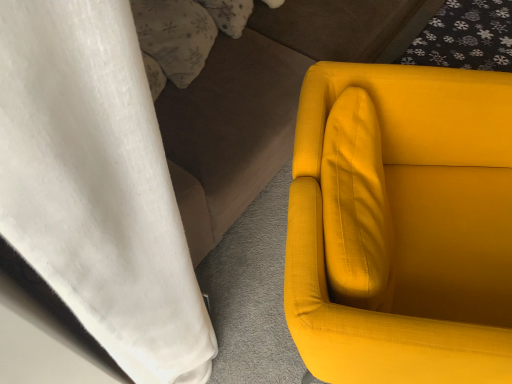
Question: Is fluffy white pillow at upper left looking in the opposite direction of matte yellow fabric chair at right?

Choices:
 (A) yes
 (B) no

Answer: (B)

Question: From a real-world perspective, is fluffy white pillow at upper left located higher than matte yellow fabric chair at right?

Choices:
 (A) yes
 (B) no

Answer: (A)

Question: Is fluffy white pillow at upper left positioned behind matte yellow fabric chair at right?

Choices:
 (A) yes
 (B) no

Answer: (A)

Question: Is matte yellow fabric chair at right surrounded by fluffy white pillow at upper left?

Choices:
 (A) yes
 (B) no

Answer: (B)

Question: Does fluffy white pillow at upper left have a greater height compared to matte yellow fabric chair at right?

Choices:
 (A) no
 (B) yes

Answer: (A)

Question: From the image's perspective, is fluffy white pillow at upper left positioned above or below matte yellow fabric couch at right?

Choices:
 (A) below
 (B) above

Answer: (A)

Question: Considering their positions, is fluffy white pillow at upper left located in front of or behind matte yellow fabric couch at right?

Choices:
 (A) behind
 (B) front

Answer: (A)

Question: Looking at the image, does fluffy white pillow at upper left seem bigger or smaller compared to matte yellow fabric couch at right?

Choices:
 (A) small
 (B) big

Answer: (A)

Question: Is fluffy white pillow at upper left situated inside matte yellow fabric couch at right or outside?

Choices:
 (A) outside
 (B) inside

Answer: (B)

Question: Looking at their shapes, would you say matte yellow fabric chair at right is wider or thinner than matte yellow fabric couch at right?

Choices:
 (A) thin
 (B) wide

Answer: (A)

Question: From their relative heights in the image, would you say matte yellow fabric chair at right is taller or shorter than matte yellow fabric couch at right?

Choices:
 (A) tall
 (B) short

Answer: (B)

Question: Is matte yellow fabric chair at right situated inside matte yellow fabric couch at right or outside?

Choices:
 (A) inside
 (B) outside

Answer: (B)

Question: Considering their positions, is matte yellow fabric chair at right located in front of or behind matte yellow fabric couch at right?

Choices:
 (A) behind
 (B) front

Answer: (B)

Question: Visually, is fluffy white pillow at upper left positioned to the left or to the right of matte yellow fabric chair at right?

Choices:
 (A) right
 (B) left

Answer: (B)

Question: Is fluffy white pillow at upper left bigger or smaller than matte yellow fabric chair at right?

Choices:
 (A) big
 (B) small

Answer: (B)